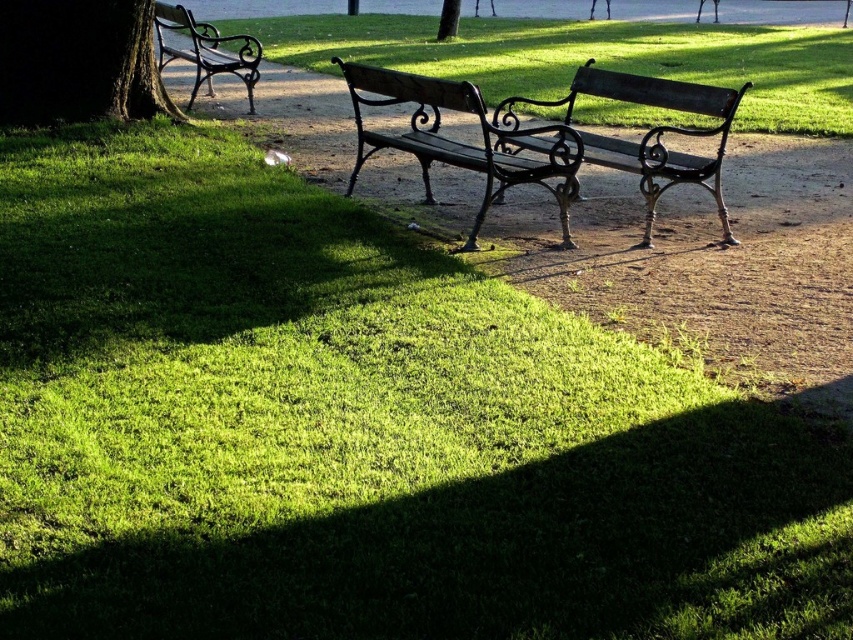
Question: Which object is positioned farthest from the green grass at center?

Choices:
 (A) green leafy tree at upper center
 (B) matte black bench at center
 (C) polished dark wood bench at left

Answer: (B)

Question: Considering the relative positions of wooden park bench at center and matte black bench at center in the image provided, where is wooden park bench at center located with respect to matte black bench at center?

Choices:
 (A) right
 (B) left

Answer: (B)

Question: In this image, where is green grass at center located relative to green textured tree trunk at left?

Choices:
 (A) right
 (B) left

Answer: (A)

Question: Among these objects, which one is farthest from the camera?

Choices:
 (A) green textured tree trunk at left
 (B) wooden park bench at center
 (C) green grass at center
 (D) green leafy tree at upper center

Answer: (D)

Question: Is green grass at center in front of green leafy tree at upper center?

Choices:
 (A) yes
 (B) no

Answer: (A)

Question: Which point is farther to the camera?

Choices:
 (A) (817, 51)
 (B) (647, 157)
 (C) (567, 237)
 (D) (32, 58)

Answer: (A)